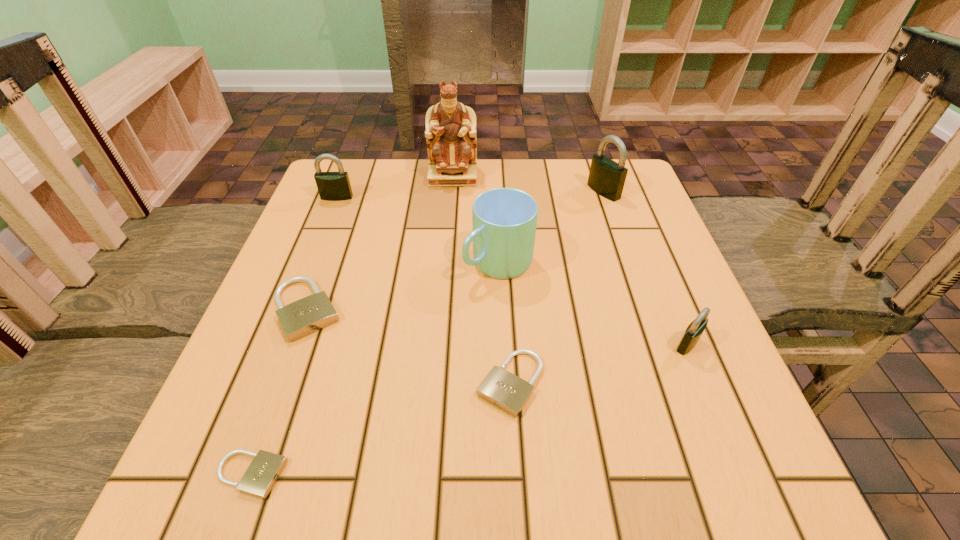
Where is `the tallest object`? the tallest object is located at coordinates coord(450,132).

Image resolution: width=960 pixels, height=540 pixels. Find the location of `the biggest black padlock`. the biggest black padlock is located at coordinates (606, 177).

Where is `mug`? The height and width of the screenshot is (540, 960). mug is located at coordinates (504, 220).

This screenshot has width=960, height=540. In order to click on the leftmost black padlock in this screenshot , I will do `click(332, 186)`.

The width and height of the screenshot is (960, 540). In order to click on the second smallest black padlock in this screenshot , I will do `click(332, 186)`.

I want to click on the fourth shortest object, so click(x=695, y=329).

This screenshot has height=540, width=960. What are the coordinates of `the third tallest padlock` in the screenshot? It's located at (695, 329).

Identify the location of the sixth tallest object. (300, 318).

At what (x,y) coordinates should I click in order to perform the action: click on the third shortest padlock. Please return your answer as a coordinate pair (x, y). Image resolution: width=960 pixels, height=540 pixels. Looking at the image, I should click on (300, 318).

Where is `the second smallest beige padlock`? the second smallest beige padlock is located at coordinates (501, 388).